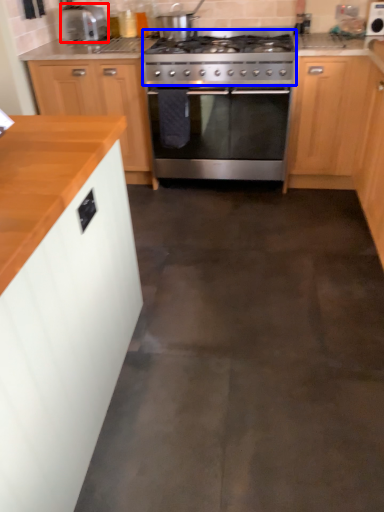
Question: Which object appears farthest to the camera in this image, kitchen appliance (highlighted by a red box) or gas stove (highlighted by a blue box)?

Choices:
 (A) kitchen appliance
 (B) gas stove

Answer: (A)